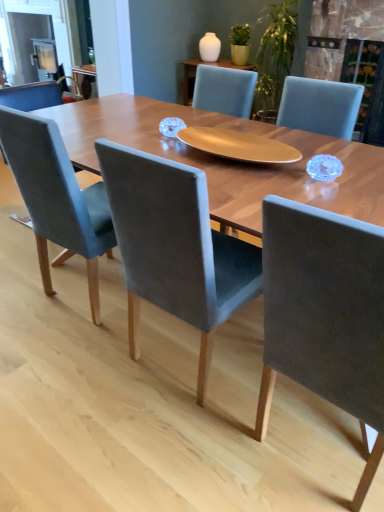
Find the location of a particular element. This screenshot has width=384, height=512. vacant space that is to the left of suede-like gray chair at center, positioned as the third chair in left-to-right order is located at coordinates pyautogui.click(x=204, y=449).